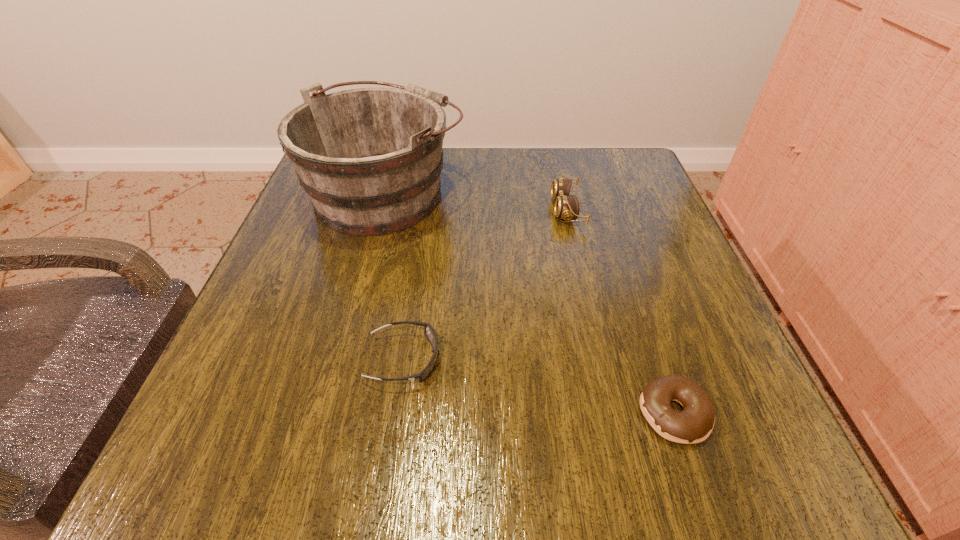
The image size is (960, 540). Identify the location of empty location between the tallest object and the rightmost object. (530, 302).

The image size is (960, 540). I want to click on vacant area that lies between the left goggles and the wine bucket, so (x=395, y=275).

The image size is (960, 540). In order to click on free space between the tallest object and the right goggles in this screenshot , I will do `click(477, 201)`.

Where is `free space between the shorter goggles and the wine bucket`? This screenshot has width=960, height=540. free space between the shorter goggles and the wine bucket is located at coordinates (395, 275).

Locate an element on the screen. unoccupied area between the tallest object and the second object from right to left is located at coordinates [x=477, y=201].

Where is `vacant space in between the doughnut and the tallest object`? The image size is (960, 540). vacant space in between the doughnut and the tallest object is located at coordinates 530,302.

Select which object is the third closest to the third shortest object. Please provide its 2D coordinates. Your answer should be formatted as a tuple, i.e. [(x, y)], where the tuple contains the x and y coordinates of a point satisfying the conditions above.

[(694, 424)]

Choose which object is the second nearest neighbor to the left goggles. Please provide its 2D coordinates. Your answer should be formatted as a tuple, i.e. [(x, y)], where the tuple contains the x and y coordinates of a point satisfying the conditions above.

[(694, 424)]

The image size is (960, 540). I want to click on free space that satisfies the following two spatial constraints: 1. through the lenses of the right goggles; 2. on the right side of the doughnut, so click(x=614, y=413).

At what (x,y) coordinates should I click in order to perform the action: click on free spot that satisfies the following two spatial constraints: 1. on the lenses of the nearer goggles; 2. on the back side of the rightmost object. Please return your answer as a coordinate pair (x, y). Looking at the image, I should click on (396, 413).